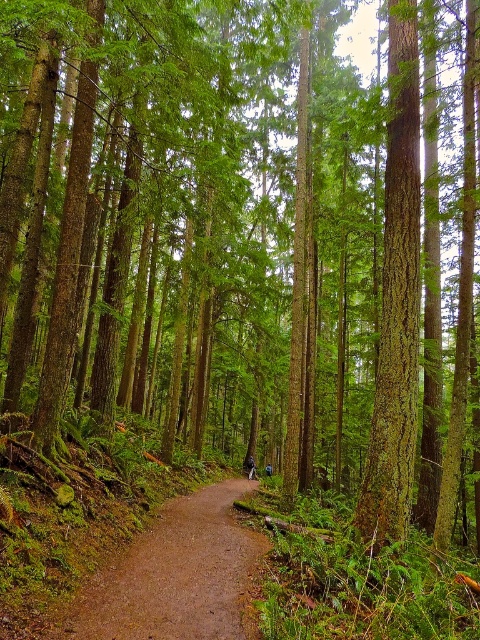
You are a hiker carrying a large backpack and need to walk along the brown dirt path at center. There is a green rough bark tree at center blocking your way. Can you pass through the area between them without needing to detour?

The brown dirt path at center is larger in size than green rough bark tree at center, so yes, you can pass through the area between them without needing to detour since the path is wider than the tree.

You are standing at the edge of the forest and want to find the brown dirt path at center. According to the coordinates provided, where should you look to locate it?

The brown dirt path at center is located at coordinates point (178,576).